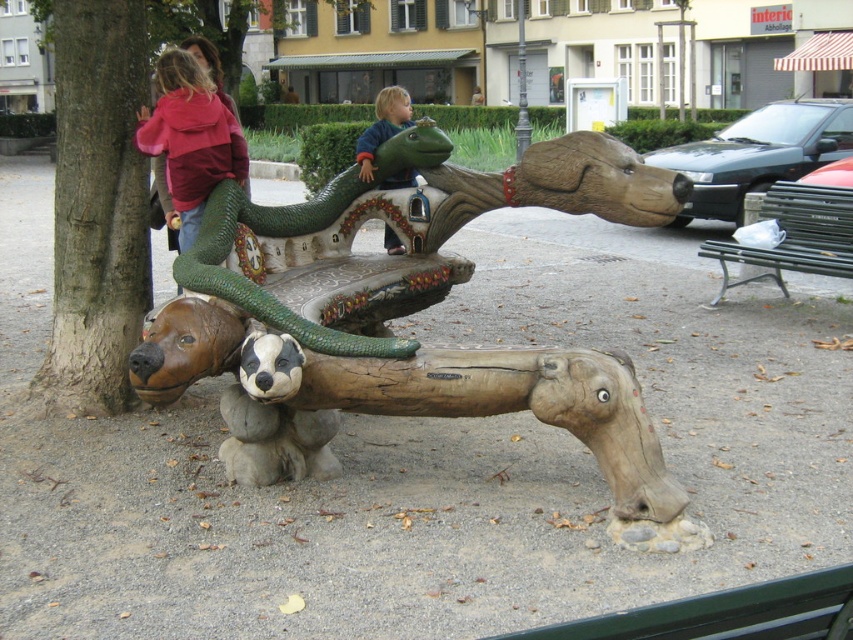
Question: Can you confirm if wooden bench at center is positioned below matte pink hoodie at upper left?

Choices:
 (A) no
 (B) yes

Answer: (B)

Question: Estimate the real-world distances between objects in this image. Which object is closer to the metallic silver bench at right?

Choices:
 (A) green matte snake at center
 (B) blue denim jacket at center

Answer: (B)

Question: Which is farther from the metallic silver bench at right?

Choices:
 (A) green matte snake at center
 (B) blue denim jacket at center

Answer: (A)

Question: Among these points, which one is farthest from the camera?

Choices:
 (A) (770, 262)
 (B) (140, 342)
 (C) (107, 307)
 (D) (334, 333)

Answer: (A)

Question: In this image, where is brown rough bark at lower left located relative to matte pink hoodie at upper left?

Choices:
 (A) left
 (B) right

Answer: (A)

Question: Is wooden bench at center positioned before green matte snake at center?

Choices:
 (A) yes
 (B) no

Answer: (A)